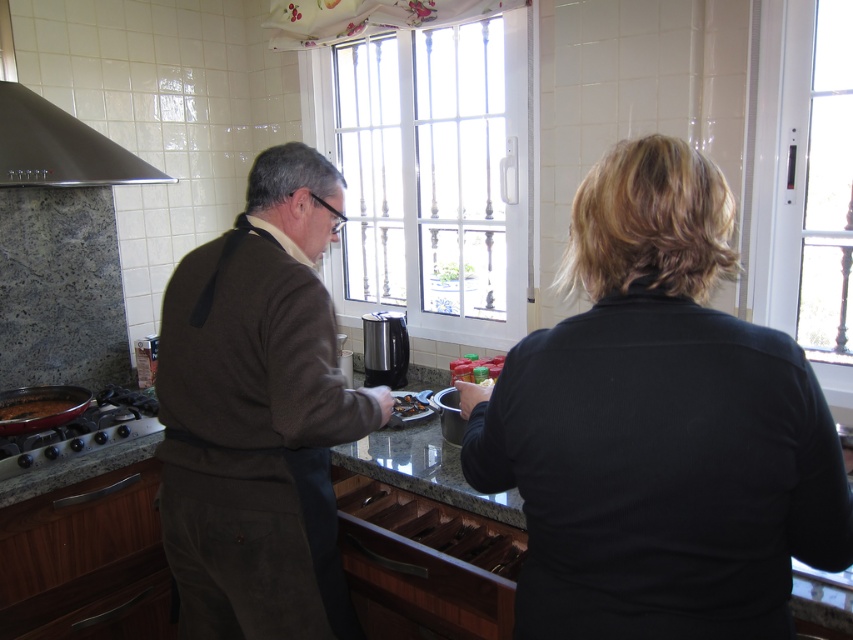
Does black matte shirt at center have a greater height compared to granite countertop at center?

Indeed, black matte shirt at center has a greater height compared to granite countertop at center.

Is black matte shirt at center closer to camera compared to granite countertop at center?

Yes, it is in front of granite countertop at center.

Locate an element on the screen. This screenshot has height=640, width=853. black matte shirt at center is located at coordinates (659, 426).

Locate an element on the screen. Image resolution: width=853 pixels, height=640 pixels. black matte shirt at center is located at coordinates (659, 426).

Describe the element at coordinates (258, 416) in the screenshot. I see `brown corduroy sweater at center` at that location.

Can you confirm if brown corduroy sweater at center is positioned to the left of granite countertop at center?

Yes, brown corduroy sweater at center is to the left of granite countertop at center.

Does point (190, 428) come in front of point (502, 500)?

Yes.

I want to click on brown corduroy sweater at center, so click(x=258, y=416).

Who is lower down, granite countertop at center or satin silver exhaust hood at upper left?

Positioned lower is granite countertop at center.

From the picture: Can you confirm if granite countertop at center is thinner than satin silver exhaust hood at upper left?

Yes.

Is point (415, 374) positioned before point (10, 145)?

No, (415, 374) is behind (10, 145).

At what (x,y) coordinates should I click in order to perform the action: click on granite countertop at center. Please return your answer as a coordinate pair (x, y). This screenshot has width=853, height=640. Looking at the image, I should click on (426, 470).